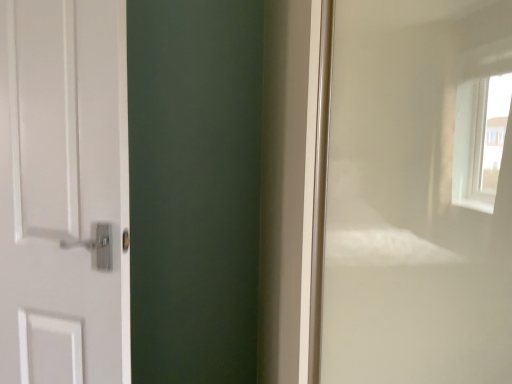
Question: Considering the positions of point (46, 38) and point (336, 336), is point (46, 38) closer or farther from the camera than point (336, 336)?

Choices:
 (A) closer
 (B) farther

Answer: (B)

Question: Looking at the image, does white matte door at left seem bigger or smaller compared to white glossy window frame at right?

Choices:
 (A) big
 (B) small

Answer: (B)

Question: From a real-world perspective, relative to white glossy window frame at right, is white matte door at left vertically above or below?

Choices:
 (A) below
 (B) above

Answer: (B)

Question: Is white glossy window frame at right inside the boundaries of white matte door at left, or outside?

Choices:
 (A) outside
 (B) inside

Answer: (A)

Question: Looking at the image, does white glossy window frame at right seem bigger or smaller compared to white matte door at left?

Choices:
 (A) small
 (B) big

Answer: (B)

Question: From a real-world perspective, is white glossy window frame at right positioned above or below white matte door at left?

Choices:
 (A) above
 (B) below

Answer: (B)

Question: Would you say white glossy window frame at right is to the left or to the right of white matte door at left in the picture?

Choices:
 (A) left
 (B) right

Answer: (B)